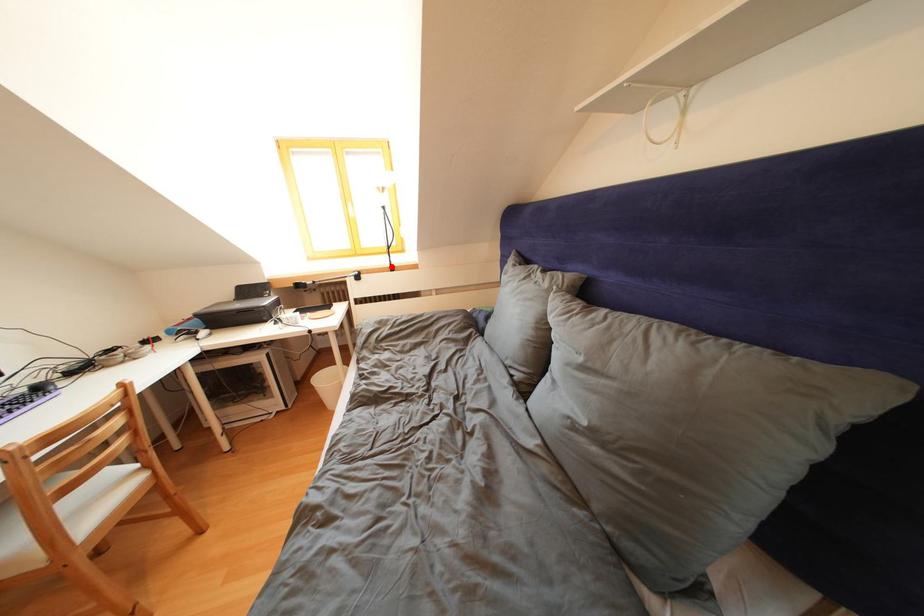
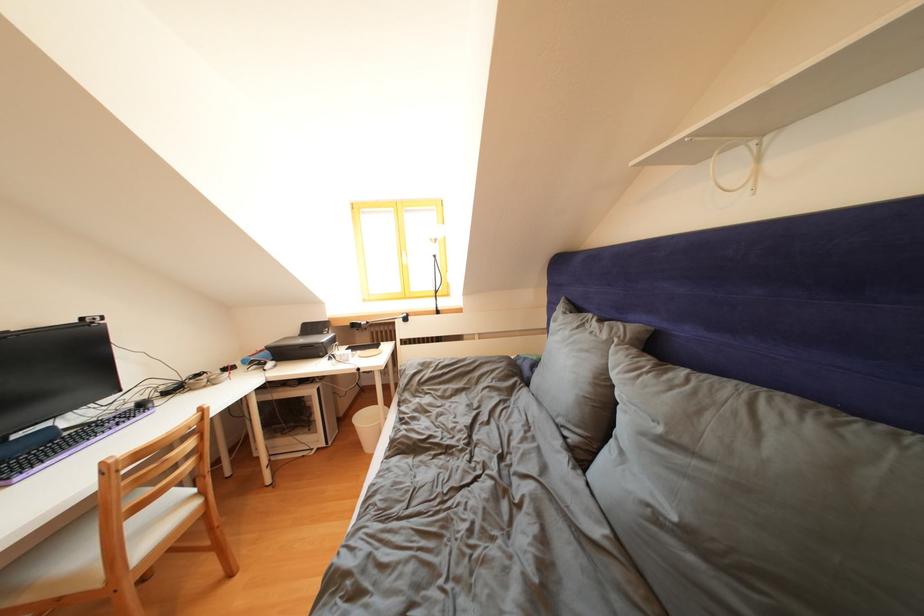
Find the pixel in the second image that matches the highlighted location in the first image.

(438, 310)